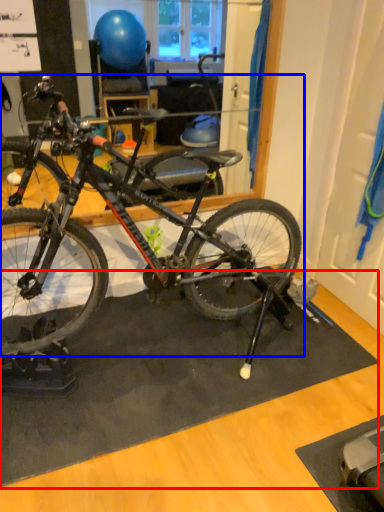
Question: Which object is further to the camera taking this photo, doormat (highlighted by a red box) or bicycle (highlighted by a blue box)?

Choices:
 (A) doormat
 (B) bicycle

Answer: (A)